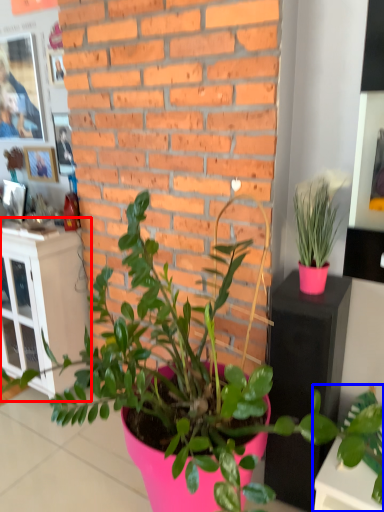
Question: Which of the following is the closest to the observer, file cabinet (highlighted by a red box) or houseplant (highlighted by a blue box)?

Choices:
 (A) file cabinet
 (B) houseplant

Answer: (B)